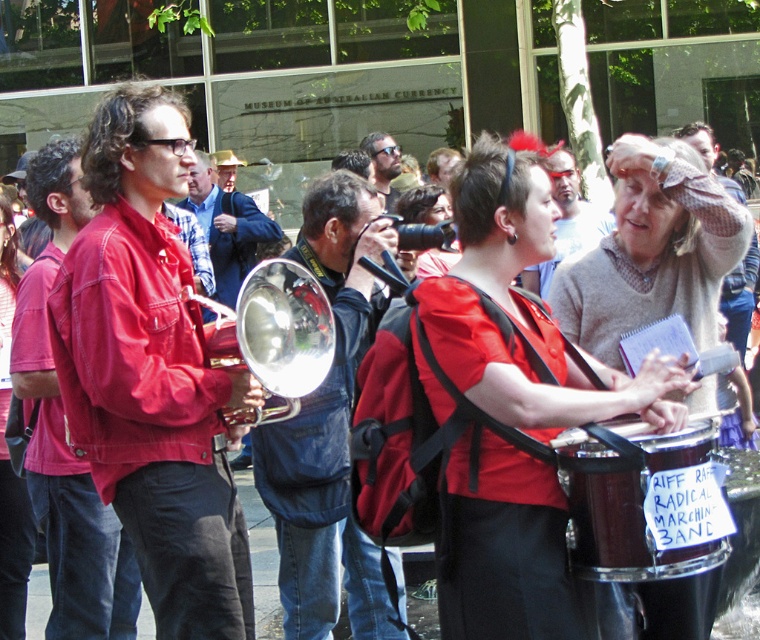
Question: Which object appears closest to the camera in this image?

Choices:
 (A) shiny brass trumpet at center
 (B) matte black sunglasses at center
 (C) denim jacket at left
 (D) gray wool sweater at upper right

Answer: (A)

Question: Can you confirm if matte red jacket at left is positioned above denim jacket at left?

Choices:
 (A) yes
 (B) no

Answer: (A)

Question: Can you confirm if denim jacket at left is bigger than gray wool sweater at upper right?

Choices:
 (A) no
 (B) yes

Answer: (A)

Question: Observing the image, what is the correct spatial positioning of matte red jacket at left in reference to shiny brass trumpet at center?

Choices:
 (A) left
 (B) right

Answer: (A)

Question: Which is nearer to the shiny silver trumpet at center?

Choices:
 (A) shiny brass trumpet at center
 (B) shiny dark brown drum at center

Answer: (A)

Question: Which of the following is the closest to the observer?

Choices:
 (A) matte red jacket at left
 (B) shiny dark brown drum at center
 (C) matte black sunglasses at center

Answer: (B)